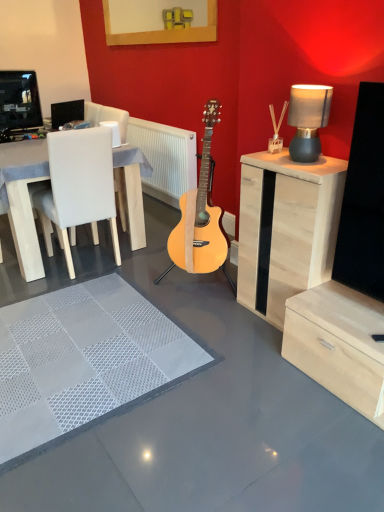
Question: Can you confirm if white leather chair at left is positioned to the left of light wood cabinet at right?

Choices:
 (A) no
 (B) yes

Answer: (B)

Question: Is white leather chair at left further to the viewer compared to light wood cabinet at right?

Choices:
 (A) yes
 (B) no

Answer: (A)

Question: From a real-world perspective, is white leather chair at left below light wood cabinet at right?

Choices:
 (A) no
 (B) yes

Answer: (A)

Question: Considering the relative sizes of white leather chair at left and light wood cabinet at right in the image provided, is white leather chair at left shorter than light wood cabinet at right?

Choices:
 (A) yes
 (B) no

Answer: (B)

Question: Can you confirm if white leather chair at left is thinner than light wood cabinet at right?

Choices:
 (A) yes
 (B) no

Answer: (B)

Question: Can you see white leather chair at left touching light wood cabinet at right?

Choices:
 (A) no
 (B) yes

Answer: (A)

Question: Is the position of black plastic speaker at upper left less distant than that of light wood cabinet at right?

Choices:
 (A) yes
 (B) no

Answer: (B)

Question: Can you confirm if black plastic speaker at upper left is shorter than light wood cabinet at right?

Choices:
 (A) yes
 (B) no

Answer: (A)

Question: Is black plastic speaker at upper left outside light wood cabinet at right?

Choices:
 (A) yes
 (B) no

Answer: (A)

Question: Can you see black plastic speaker at upper left touching light wood cabinet at right?

Choices:
 (A) no
 (B) yes

Answer: (A)

Question: Considering the relative sizes of black plastic speaker at upper left and light wood cabinet at right in the image provided, is black plastic speaker at upper left smaller than light wood cabinet at right?

Choices:
 (A) yes
 (B) no

Answer: (A)

Question: From the image's perspective, is black plastic speaker at upper left on top of light wood cabinet at right?

Choices:
 (A) no
 (B) yes

Answer: (B)

Question: From the image's perspective, is white textured rug at center on top of black plastic speaker at upper left?

Choices:
 (A) no
 (B) yes

Answer: (A)